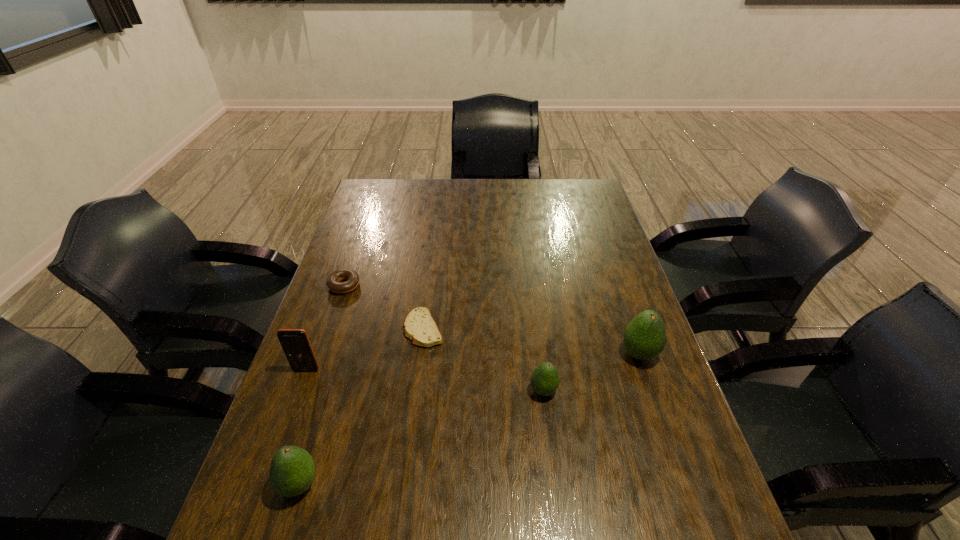
Choose which object is the second nearest neighbor to the nearest object. Please provide its 2D coordinates. Your answer should be formatted as a tuple, i.e. [(x, y)], where the tuple contains the x and y coordinates of a point satisfying the conditions above.

[(419, 326)]

Identify which avocado is located as the second nearest to the nearest object. Please provide its 2D coordinates. Your answer should be formatted as a tuple, i.e. [(x, y)], where the tuple contains the x and y coordinates of a point satisfying the conditions above.

[(645, 337)]

Locate which avocado is the second closest to the nearest avocado. Please provide its 2D coordinates. Your answer should be formatted as a tuple, i.e. [(x, y)], where the tuple contains the x and y coordinates of a point satisfying the conditions above.

[(645, 337)]

Locate an element on the screen. The image size is (960, 540). blank area in the image that satisfies the following two spatial constraints: 1. on the back side of the nearest object; 2. on the left side of the second farthest avocado is located at coordinates (328, 390).

The height and width of the screenshot is (540, 960). I want to click on blank area in the image that satisfies the following two spatial constraints: 1. on the screen of the cellular telephone; 2. on the right side of the second tallest avocado, so click(265, 484).